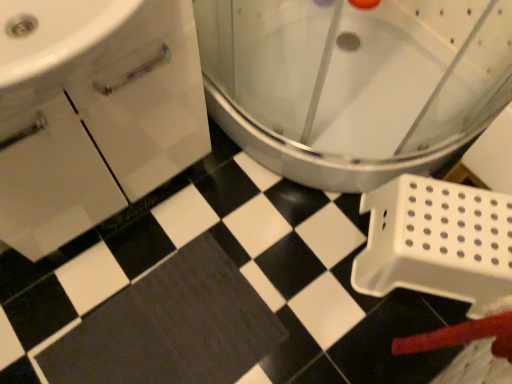
Find the location of a particular element. Image resolution: width=512 pixels, height=384 pixels. free space underneath black matte bath mat at center (from a real-world perspective) is located at coordinates (163, 333).